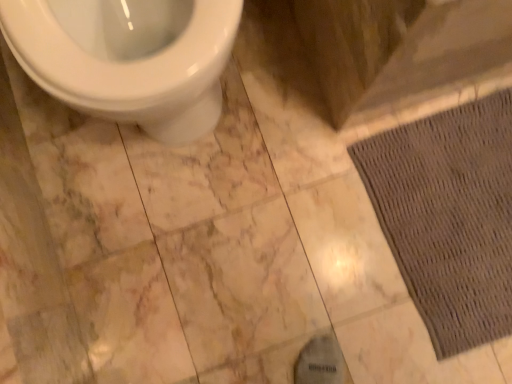
Question: From their relative heights in the image, would you say white glossy toilet at upper left is taller or shorter than brown textured mat at lower right?

Choices:
 (A) short
 (B) tall

Answer: (B)

Question: Is white glossy toilet at upper left wider or thinner than brown textured mat at lower right?

Choices:
 (A) thin
 (B) wide

Answer: (A)

Question: Is white glossy toilet at upper left inside or outside of brown textured mat at lower right?

Choices:
 (A) outside
 (B) inside

Answer: (A)

Question: From a real-world perspective, is brown textured mat at lower right positioned above or below white glossy toilet at upper left?

Choices:
 (A) above
 (B) below

Answer: (B)

Question: Would you say brown textured mat at lower right is inside or outside white glossy toilet at upper left?

Choices:
 (A) outside
 (B) inside

Answer: (A)

Question: Considering the positions of brown textured mat at lower right and white glossy toilet at upper left in the image, is brown textured mat at lower right bigger or smaller than white glossy toilet at upper left?

Choices:
 (A) small
 (B) big

Answer: (A)

Question: In terms of height, does brown textured mat at lower right look taller or shorter compared to white glossy toilet at upper left?

Choices:
 (A) short
 (B) tall

Answer: (A)